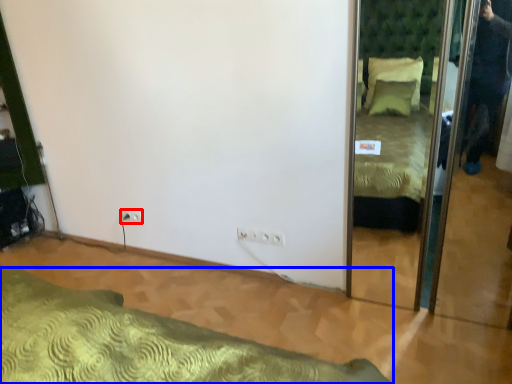
Question: Which of the following is the farthest to the observer, electric outlet (highlighted by a red box) or bed (highlighted by a blue box)?

Choices:
 (A) electric outlet
 (B) bed

Answer: (A)